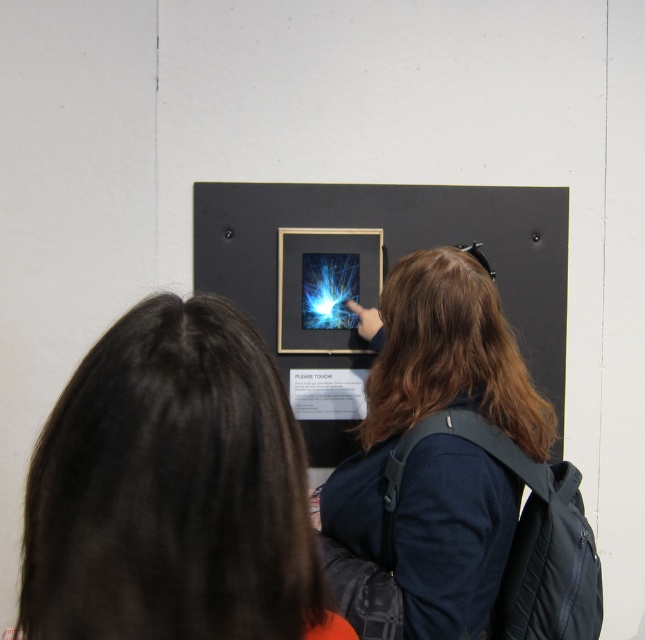
You are standing in front of the wall display and notice two points marked on the image. Which point, point [132,522] or point [430,308], is nearer to you?

Point [132,522] is closer to the viewer than point [430,308].

You are a photographer standing at the camera position. You want to take a photo of the dark brown hair at center so that it fills the frame. Based on the scene description, what is the minimum distance you need to move forward or backward to achieve this?

The dark brown hair at center is 53.96 centimeters from the camera. To fill the frame, you would need to adjust your distance so that the subject occupies the desired portion of the frame, but since the exact focal length and sensor size are unknown, the minimum adjustment can be calculated using the formula for magnification. However, without additional parameters, we can state that moving closer or farther depends on whether the current framing is too small or large. Given the information provided, the 53